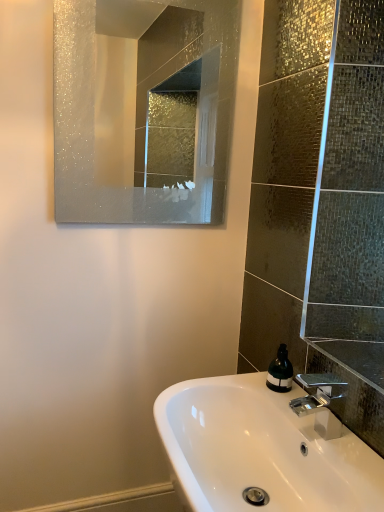
Where is `free location to the left of green matte soap dispenser at lower right`? free location to the left of green matte soap dispenser at lower right is located at coordinates (239, 384).